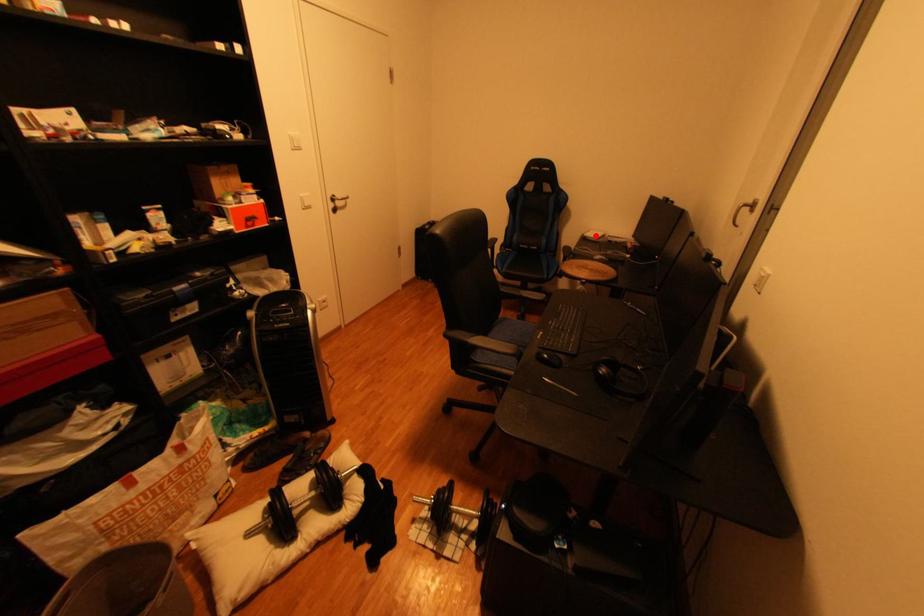
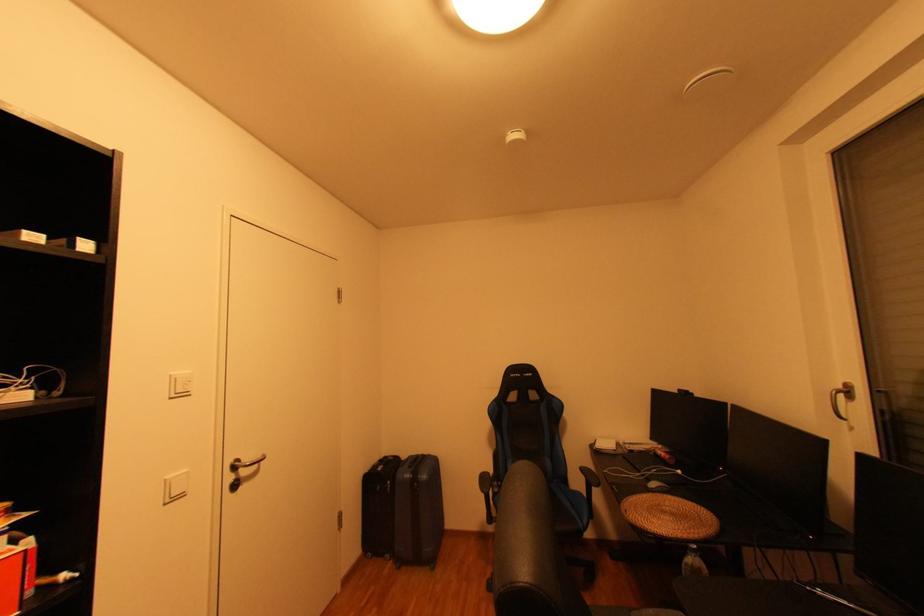
Where in the second image is the point corresponding to the highlighted location from the first image?

(606, 448)